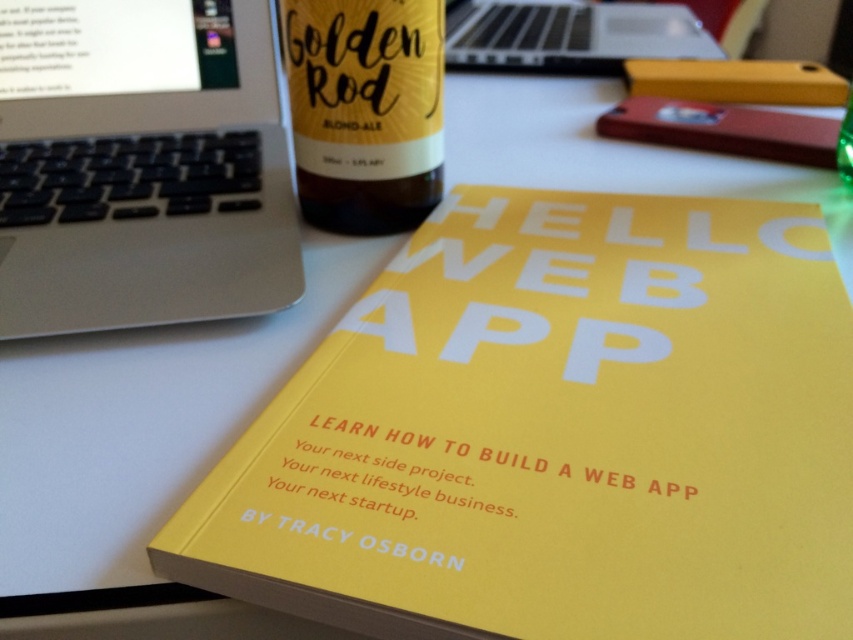
Question: Is silver/black keyboard at upper center positioned before matte glass bottle at upper center?

Choices:
 (A) no
 (B) yes

Answer: (A)

Question: Is yellow matte glass bottle at center below silver/black keyboard at upper center?

Choices:
 (A) yes
 (B) no

Answer: (A)

Question: Based on their relative distances, which object is farther from the yellow matte glass bottle at center?

Choices:
 (A) matte glass bottle at upper center
 (B) silver/black keyboard at upper center
 (C) silver/black plastic laptop at upper left

Answer: (B)

Question: Can you confirm if silver/black plastic laptop at upper left is thinner than silver/black keyboard at upper center?

Choices:
 (A) no
 (B) yes

Answer: (B)

Question: Which object is closer to the camera taking this photo?

Choices:
 (A) matte glass bottle at upper center
 (B) silver/black plastic laptop at upper left
 (C) yellow matte glass bottle at center

Answer: (B)

Question: Which point is closer to the camera?

Choices:
 (A) (843, 64)
 (B) (805, 451)
 (C) (115, 193)

Answer: (B)